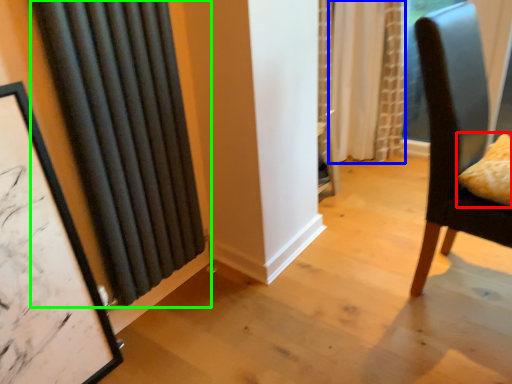
Question: Which is farther away from pillow (highlighted by a red box)? curtain (highlighted by a blue box) or curtain (highlighted by a green box)?

Choices:
 (A) curtain
 (B) curtain

Answer: (A)